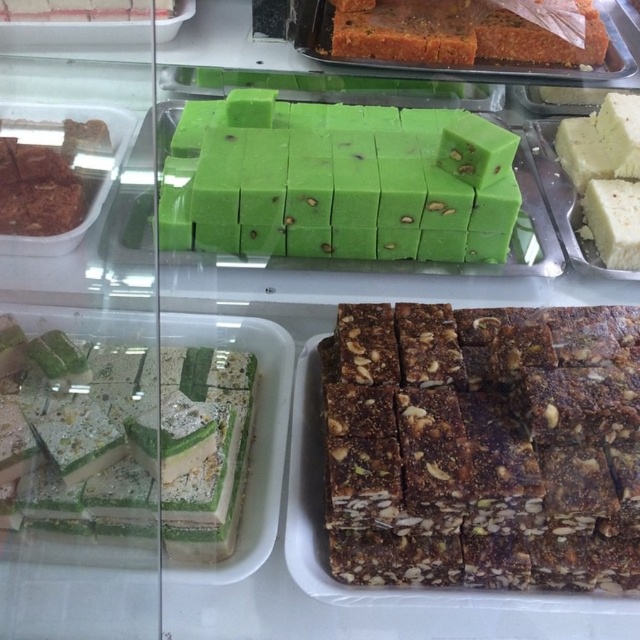
You are a customer at a bakery and want to choose between the dark brown crumbly bar at center and the green soft candy at center. Which one has a greater height?

The dark brown crumbly bar at center is taller than the green soft candy at center, so it has a greater height.

You are a customer at the bakery and want to buy both the dark brown crumbly bar at center and the white creamy cake at right. If you reach out your hand from where you are standing, which item will you be able to grab first?

The dark brown crumbly bar at center is closer to the viewer than the white creamy cake at right, so you can grab it first.